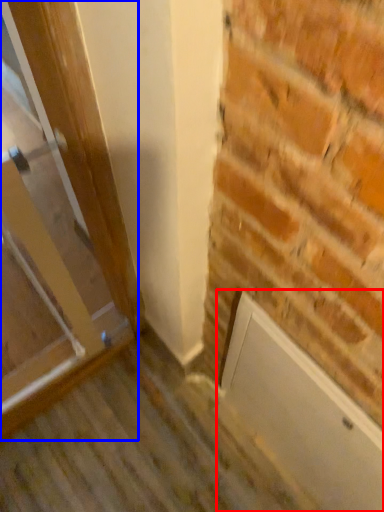
Question: Which object is further to the camera taking this photo, screen door (highlighted by a red box) or door (highlighted by a blue box)?

Choices:
 (A) screen door
 (B) door

Answer: (A)